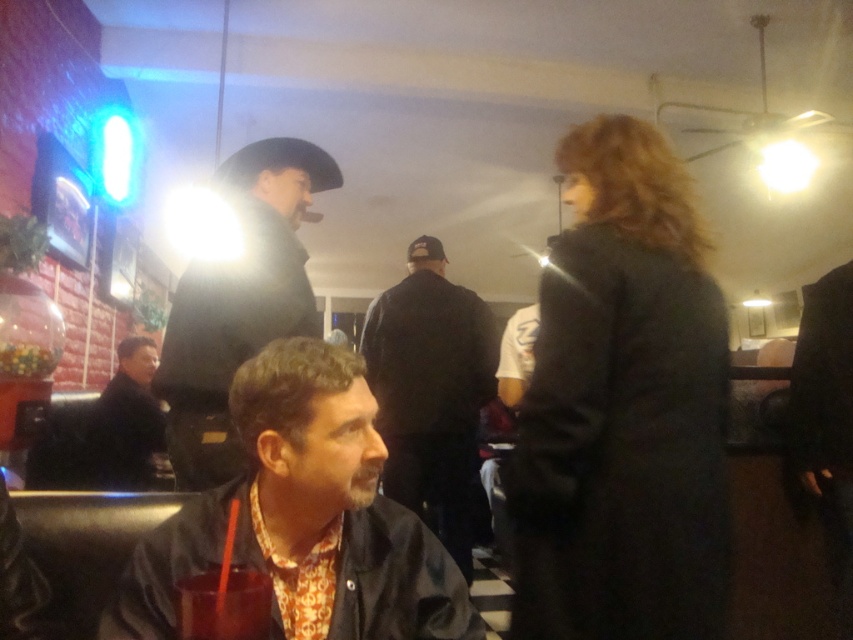
Based on the photo, you are a bartender who needs to place a 12 inch wide tray between the floral shirt at center and the black leather cowboy hat at upper left. Can the tray fit between them without overlapping either object?

The distance between the floral shirt at center and the black leather cowboy hat at upper left is 24.10 inches. Since the tray is 12 inches wide, it can fit between them as the space is twice the tray width, allowing sufficient clearance on both sides.

You are a customer in this bar and you want to reach for the translucent glass drink at lower center. Is the dark gray coat at center blocking your access to it?

The translucent glass drink at lower center is behind the dark gray coat at center, so the coat is blocking your access to the drink.